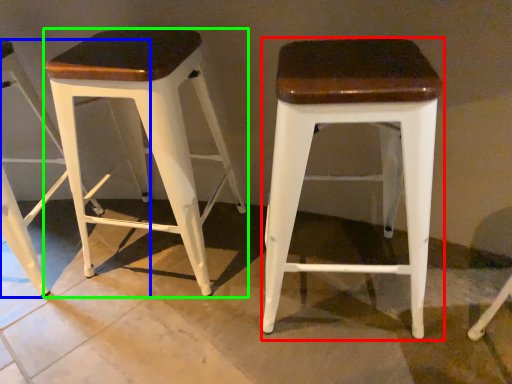
Question: Which object is the closest to the stool (highlighted by a red box)? Choose among these: stool (highlighted by a blue box) or stool (highlighted by a green box).

Choices:
 (A) stool
 (B) stool

Answer: (B)